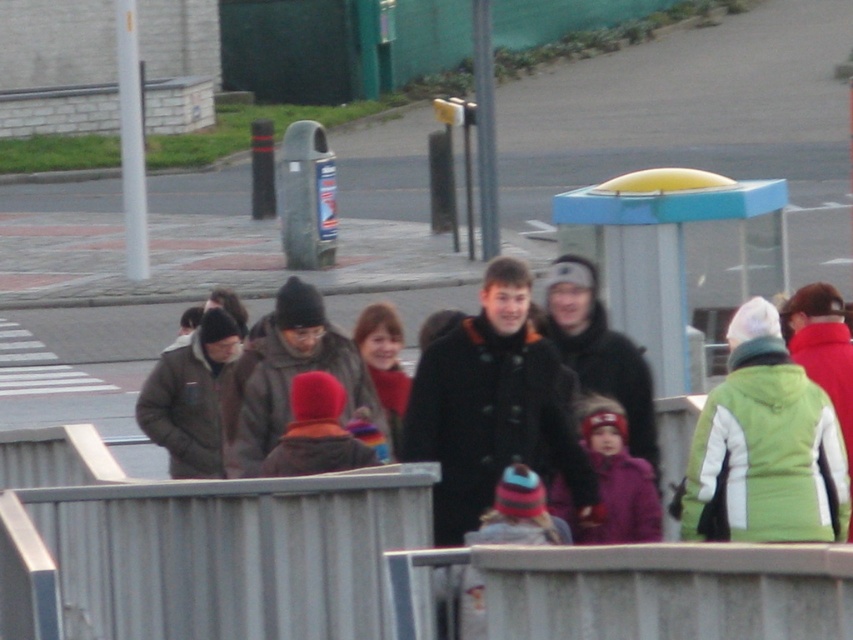
Who is positioned more to the left, black wool coat at center or red knit hat at center?

red knit hat at center

Can you confirm if black wool coat at center is positioned below red knit hat at center?

No, black wool coat at center is not below red knit hat at center.

Identify the location of black wool coat at center. The image size is (853, 640). (492, 406).

Between green and white jacket at right and red knit hat at center, which one appears on the left side from the viewer's perspective?

From the viewer's perspective, red knit hat at center appears more on the left side.

Between green and white jacket at right and red knit hat at center, which one is positioned higher?

green and white jacket at right is higher up.

Where is `green and white jacket at right`? The height and width of the screenshot is (640, 853). green and white jacket at right is located at coordinates (764, 448).

Who is higher up, metallic gray rail at lower center or gray metallic rail at center?

gray metallic rail at center is higher up.

Is metallic gray rail at lower center to the right of gray metallic rail at center from the viewer's perspective?

No, metallic gray rail at lower center is not to the right of gray metallic rail at center.

Find the location of a particular element. The height and width of the screenshot is (640, 853). metallic gray rail at lower center is located at coordinates (218, 556).

Find the location of a particular element. The height and width of the screenshot is (640, 853). metallic gray rail at lower center is located at coordinates (218, 556).